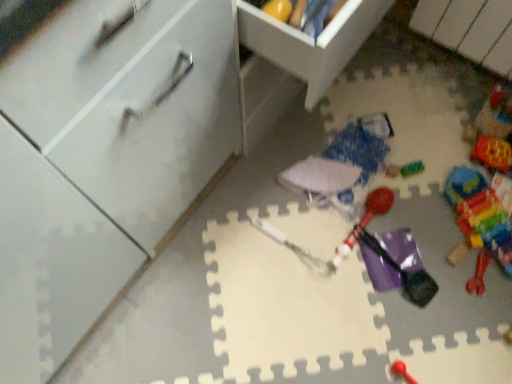
How much space does translucent plastic blocks at lower right, acting as the 7th toy starting from the left, occupy horizontally?

translucent plastic blocks at lower right, acting as the 7th toy starting from the left, is 6.26 inches wide.

How much space does translucent plastic bag at center, positioned as the 3th toy in left-to-right order, occupy vertically?

The height of translucent plastic bag at center, positioned as the 3th toy in left-to-right order, is 1.36 inches.

This screenshot has height=384, width=512. I want to click on rubber red toy at lower right, marked as the 3th toy in a right-to-left arrangement, so click(x=479, y=273).

Based on their positions, is white matte drawer at upper center, which is the second cabinetry from left to right, located to the left or right of translucent plastic blocks at lower right, acting as the 7th toy starting from the left?

Based on their positions, white matte drawer at upper center, which is the second cabinetry from left to right, is located to the left of translucent plastic blocks at lower right, acting as the 7th toy starting from the left.

Based on the photo, from the image's perspective, which is above, white matte drawer at upper center, which appears as the 1th cabinetry when viewed from the right, or translucent plastic blocks at lower right, the first toy viewed from the right?

white matte drawer at upper center, which appears as the 1th cabinetry when viewed from the right, from the image's perspective.

Which object is closer to the camera taking this photo, white matte drawer at upper center, which is the second cabinetry from left to right, or translucent plastic blocks at lower right, acting as the 7th toy starting from the left?

white matte drawer at upper center, which is the second cabinetry from left to right, is more forward.

Could translucent plastic blocks at lower right, acting as the 7th toy starting from the left, be considered to be inside white matte drawer at upper center, which is the second cabinetry from left to right?

Actually, translucent plastic blocks at lower right, acting as the 7th toy starting from the left, is outside white matte drawer at upper center, which is the second cabinetry from left to right.

Which is behind, purple fabric shovel at center, the 4th toy viewed from the left, or white matte drawer at upper center, which appears as the 1th cabinetry when viewed from the right?

purple fabric shovel at center, the 4th toy viewed from the left, is more distant.

From the image's perspective, is purple fabric shovel at center, the 4th toy viewed from the left, positioned above or below white matte drawer at upper center, which appears as the 1th cabinetry when viewed from the right?

purple fabric shovel at center, the 4th toy viewed from the left, is below white matte drawer at upper center, which appears as the 1th cabinetry when viewed from the right.

Does point (368, 232) come farther from viewer compared to point (338, 38)?

Yes, point (368, 232) is behind point (338, 38).

Does translucent plastic bag at center, positioned as the 3th toy in left-to-right order, have a lesser height compared to white matte cabinet at left, which is the first cabinetry from left to right?

Yes.

Is translucent plastic bag at center, marked as the 5th toy in a right-to-left arrangement, turned away from white matte cabinet at left, which is the second cabinetry in right-to-left order?

No, translucent plastic bag at center, marked as the 5th toy in a right-to-left arrangement,'s orientation is not away from white matte cabinet at left, which is the second cabinetry in right-to-left order.

Is white matte cabinet at left, which is the first cabinetry from left to right, inside translucent plastic bag at center, positioned as the 3th toy in left-to-right order?

No.

From a real-world perspective, which is physically above, translucent plastic bag at center, positioned as the 3th toy in left-to-right order, or white matte cabinet at left, which is the first cabinetry from left to right?

Answer: From a 3D spatial view, white matte cabinet at left, which is the first cabinetry from left to right, is above.

Which object is positioned more to the right, translucent plastic blocks at lower right, acting as the 7th toy starting from the left, or white fabric umbrella at center, placed as the 7th toy when sorted from right to left?

translucent plastic blocks at lower right, acting as the 7th toy starting from the left.

From a real-world perspective, is translucent plastic blocks at lower right, acting as the 7th toy starting from the left, physically below white fabric umbrella at center, placed as the 7th toy when sorted from right to left?

Correct, in the physical world, translucent plastic blocks at lower right, acting as the 7th toy starting from the left, is lower than white fabric umbrella at center, placed as the 7th toy when sorted from right to left.

Which is nearer, (465, 231) or (329, 180)?

Point (465, 231) appears to be closer to the viewer than point (329, 180).

Based on the photo, in the image, is translucent plastic blocks at lower right, the first toy viewed from the right, positioned in front of or behind white fabric umbrella at center, positioned as the first toy in left-to-right order?

Visually, translucent plastic blocks at lower right, the first toy viewed from the right, is located in front of white fabric umbrella at center, positioned as the first toy in left-to-right order.

Considering the sizes of translucent plastic bag at center, marked as the 5th toy in a right-to-left arrangement, and multicolored plastic blocks at right, which is the 2th toy in right-to-left order, in the image, is translucent plastic bag at center, marked as the 5th toy in a right-to-left arrangement, wider or thinner than multicolored plastic blocks at right, which is the 2th toy in right-to-left order,?

Considering their sizes, translucent plastic bag at center, marked as the 5th toy in a right-to-left arrangement, looks slimmer than multicolored plastic blocks at right, which is the 2th toy in right-to-left order.

From the image's perspective, who appears lower, translucent plastic bag at center, marked as the 5th toy in a right-to-left arrangement, or multicolored plastic blocks at right, which is the 2th toy in right-to-left order?

multicolored plastic blocks at right, which is the 2th toy in right-to-left order, is shown below in the image.

Is translucent plastic bag at center, positioned as the 3th toy in left-to-right order, inside the boundaries of multicolored plastic blocks at right, which is the 2th toy in right-to-left order, or outside?

translucent plastic bag at center, positioned as the 3th toy in left-to-right order, exists outside the volume of multicolored plastic blocks at right, which is the 2th toy in right-to-left order.

Considering the sizes of objects translucent plastic bag at center, positioned as the 3th toy in left-to-right order, and multicolored plastic blocks at right, which is the 2th toy in right-to-left order, in the image provided, who is shorter, translucent plastic bag at center, positioned as the 3th toy in left-to-right order, or multicolored plastic blocks at right, which is the 2th toy in right-to-left order,?

Standing shorter between the two is translucent plastic bag at center, positioned as the 3th toy in left-to-right order.

From a real-world perspective, starting from the white matte cabinet at left, which is the first cabinetry from left to right, which toy is the 4th one below it? Please provide its 2D coordinates.

[(482, 218)]

Considering the relative sizes of white matte cabinet at left, which is the second cabinetry in right-to-left order, and translucent plastic blocks at lower right, the first toy viewed from the right, in the image provided, is white matte cabinet at left, which is the second cabinetry in right-to-left order, bigger than translucent plastic blocks at lower right, the first toy viewed from the right,?

Correct, white matte cabinet at left, which is the second cabinetry in right-to-left order, is larger in size than translucent plastic blocks at lower right, the first toy viewed from the right.

Is white matte cabinet at left, which is the second cabinetry in right-to-left order, situated inside translucent plastic blocks at lower right, acting as the 7th toy starting from the left, or outside?

white matte cabinet at left, which is the second cabinetry in right-to-left order, cannot be found inside translucent plastic blocks at lower right, acting as the 7th toy starting from the left.

Based on the photo, is white matte cabinet at left, which is the first cabinetry from left to right, inside rubber red toy at lower right, marked as the 3th toy in a right-to-left arrangement?

No, white matte cabinet at left, which is the first cabinetry from left to right, is not inside rubber red toy at lower right, marked as the 3th toy in a right-to-left arrangement.

From a real-world perspective, is rubber red toy at lower right, which is counted as the 5th toy, starting from the left, physically located above or below white matte cabinet at left, which is the first cabinetry from left to right?

From a real-world perspective, rubber red toy at lower right, which is counted as the 5th toy, starting from the left, is physically below white matte cabinet at left, which is the first cabinetry from left to right.

Is rubber red toy at lower right, marked as the 3th toy in a right-to-left arrangement, facing away from white matte cabinet at left, which is the first cabinetry from left to right?

No, rubber red toy at lower right, marked as the 3th toy in a right-to-left arrangement, is not facing away from white matte cabinet at left, which is the first cabinetry from left to right.

In terms of size, does rubber red toy at lower right, which is counted as the 5th toy, starting from the left, appear bigger or smaller than white matte cabinet at left, which is the second cabinetry in right-to-left order?

rubber red toy at lower right, which is counted as the 5th toy, starting from the left, is smaller than white matte cabinet at left, which is the second cabinetry in right-to-left order.

Where is `the 4th toy positioned below the white matte drawer at upper center, which appears as the 1th cabinetry when viewed from the right (from a real-world perspective)`? This screenshot has width=512, height=384. the 4th toy positioned below the white matte drawer at upper center, which appears as the 1th cabinetry when viewed from the right (from a real-world perspective) is located at coordinates (482, 218).

Where is `the 2nd cabinetry located above the purple fabric shovel at center, the 4th toy viewed from the left (from a real-world perspective)`? Image resolution: width=512 pixels, height=384 pixels. the 2nd cabinetry located above the purple fabric shovel at center, the 4th toy viewed from the left (from a real-world perspective) is located at coordinates (311, 42).

From the image, which object appears to be nearer to white fabric umbrella at center, placed as the 7th toy when sorted from right to left, rubberized red mallet at center, the sixth toy in the right-to-left sequence, or white matte drawer at upper center, which is the second cabinetry from left to right?

rubberized red mallet at center, the sixth toy in the right-to-left sequence, is positioned closer to the anchor white fabric umbrella at center, placed as the 7th toy when sorted from right to left.

When comparing their distances from translucent plastic blocks at lower right, acting as the 7th toy starting from the left, does white matte drawer at upper center, which is the second cabinetry from left to right, or translucent plastic bag at center, marked as the 5th toy in a right-to-left arrangement, seem further?

Based on the image, white matte drawer at upper center, which is the second cabinetry from left to right, appears to be further to translucent plastic blocks at lower right, acting as the 7th toy starting from the left.

Which object lies nearer to the anchor point white matte cabinet at left, which is the second cabinetry in right-to-left order, rubberized red mallet at center, the 2th toy from the left, or rubber red toy at lower right, which is counted as the 5th toy, starting from the left?

rubberized red mallet at center, the 2th toy from the left, is positioned closer to the anchor white matte cabinet at left, which is the second cabinetry in right-to-left order.

From the image, which object appears to be nearer to purple fabric shovel at center, acting as the fourth toy starting from the right, rubberized red mallet at center, the sixth toy in the right-to-left sequence, or white fabric umbrella at center, placed as the 7th toy when sorted from right to left?

The object closer to purple fabric shovel at center, acting as the fourth toy starting from the right, is rubberized red mallet at center, the sixth toy in the right-to-left sequence.

Based on their spatial positions, is white fabric umbrella at center, placed as the 7th toy when sorted from right to left, or white matte drawer at upper center, which appears as the 1th cabinetry when viewed from the right, closer to rubberized red mallet at center, the 2th toy from the left?

The object closer to rubberized red mallet at center, the 2th toy from the left, is white fabric umbrella at center, placed as the 7th toy when sorted from right to left.

Considering their positions, is white matte cabinet at left, which is the second cabinetry in right-to-left order, positioned closer to rubberized red mallet at center, the 2th toy from the left, than rubber red toy at lower right, marked as the 3th toy in a right-to-left arrangement?

rubber red toy at lower right, marked as the 3th toy in a right-to-left arrangement, is closer to rubberized red mallet at center, the 2th toy from the left.

Looking at the image, which one is located further to translucent plastic bag at center, positioned as the 3th toy in left-to-right order, rubberized red mallet at center, the sixth toy in the right-to-left sequence, or white matte cabinet at left, which is the second cabinetry in right-to-left order?

white matte cabinet at left, which is the second cabinetry in right-to-left order.

Estimate the real-world distances between objects in this image. Which object is further from purple fabric shovel at center, acting as the fourth toy starting from the right, translucent plastic bag at center, positioned as the 3th toy in left-to-right order, or white fabric umbrella at center, positioned as the first toy in left-to-right order?

translucent plastic bag at center, positioned as the 3th toy in left-to-right order, is positioned further to the anchor purple fabric shovel at center, acting as the fourth toy starting from the right.

Where is `cabinetry situated between white matte cabinet at left, which is the second cabinetry in right-to-left order, and purple fabric shovel at center, the 4th toy viewed from the left, from left to right`? cabinetry situated between white matte cabinet at left, which is the second cabinetry in right-to-left order, and purple fabric shovel at center, the 4th toy viewed from the left, from left to right is located at coordinates (311, 42).

Find the location of a particular element. This screenshot has height=384, width=512. cabinetry between white matte cabinet at left, which is the first cabinetry from left to right, and white fabric umbrella at center, positioned as the first toy in left-to-right order, along the z-axis is located at coordinates (311, 42).

You are a GUI agent. You are given a task and a screenshot of the screen. Output one action in this format:
    pyautogui.click(x=<x>, y=<y>)
    Task: Click on the cabinetry positioned between white matte cabinet at left, which is the second cabinetry in right-to-left order, and translucent plastic bag at center, positioned as the 3th toy in left-to-right order, from near to far
    The image size is (512, 384).
    Given the screenshot: What is the action you would take?
    pyautogui.click(x=311, y=42)

This screenshot has height=384, width=512. In order to click on cabinetry situated between white matte cabinet at left, which is the first cabinetry from left to right, and multicolored plastic blocks at right, which is the 2th toy in right-to-left order, from left to right in this screenshot , I will do `click(311, 42)`.